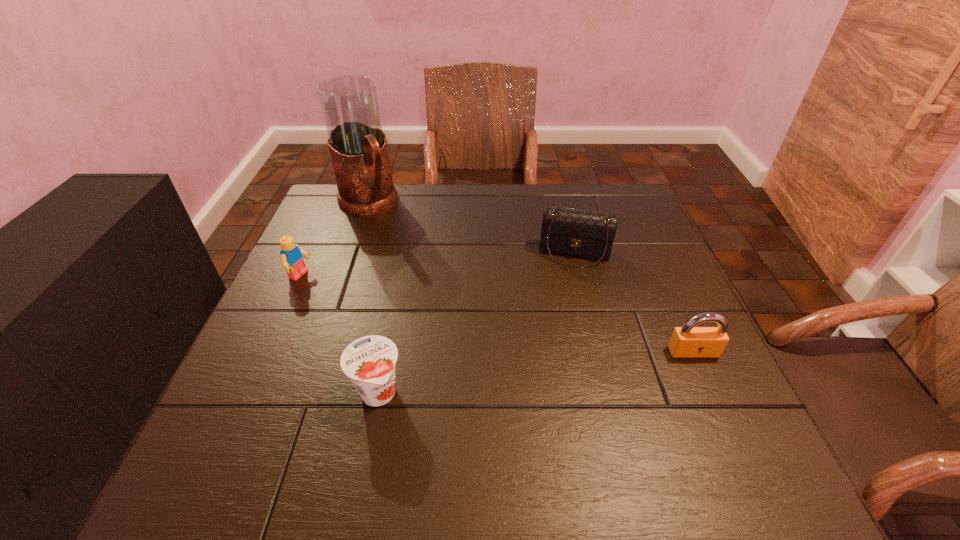
At what (x,y) coordinates should I click in order to perform the action: click on vacant position located with the handle on the side of the farthest object. Please return your answer as a coordinate pair (x, y). Looking at the image, I should click on (431, 285).

Identify the location of blank area located 0.170m with the handle on the side of the farthest object. The width and height of the screenshot is (960, 540). (404, 252).

Identify the location of vacant area situated with the handle on the side of the farthest object. The image size is (960, 540). (440, 295).

Where is `vacant point located on the front flap of the fourth object from left to right`? This screenshot has width=960, height=540. vacant point located on the front flap of the fourth object from left to right is located at coordinates (555, 396).

Where is `free space located 0.160m on the front flap of the fourth object from left to right`? The image size is (960, 540). free space located 0.160m on the front flap of the fourth object from left to right is located at coordinates point(564,313).

Where is `vacant space located 0.360m on the front flap of the fourth object from left to right`? vacant space located 0.360m on the front flap of the fourth object from left to right is located at coordinates (556, 388).

What are the coordinates of `free space located 0.050m on the front-facing side of the Lego` in the screenshot? It's located at (325, 287).

Locate an element on the screen. free spot located 0.380m on the front-facing side of the Lego is located at coordinates (448, 332).

Locate an element on the screen. free space located on the front-facing side of the Lego is located at coordinates (332, 289).

This screenshot has width=960, height=540. In order to click on object situated at the far edge in this screenshot , I will do `click(357, 144)`.